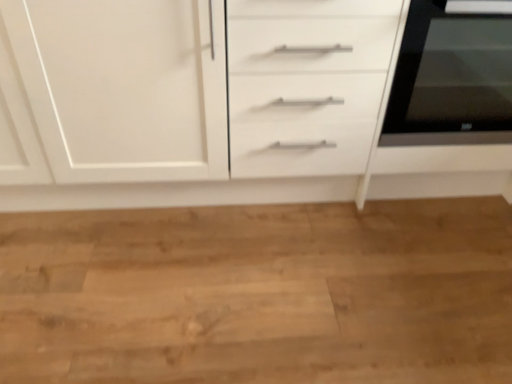
Question: Is white matte cabinet at center at the back of black glass oven at right?

Choices:
 (A) no
 (B) yes

Answer: (B)

Question: Is black glass oven at right shorter than white matte cabinet at center?

Choices:
 (A) yes
 (B) no

Answer: (A)

Question: From a real-world perspective, is black glass oven at right located higher than white matte cabinet at center?

Choices:
 (A) yes
 (B) no

Answer: (A)

Question: Can you confirm if black glass oven at right is thinner than white matte cabinet at center?

Choices:
 (A) no
 (B) yes

Answer: (B)

Question: Considering the relative sizes of black glass oven at right and white matte cabinet at center in the image provided, is black glass oven at right bigger than white matte cabinet at center?

Choices:
 (A) no
 (B) yes

Answer: (A)

Question: Is black glass oven at right to the left of white matte cabinet at center from the viewer's perspective?

Choices:
 (A) yes
 (B) no

Answer: (B)

Question: Can black glass oven at right be found inside white matte cabinet at center?

Choices:
 (A) no
 (B) yes

Answer: (B)

Question: Considering the relative positions of white matte cabinet at center and black glass oven at right in the image provided, is white matte cabinet at center to the left of black glass oven at right from the viewer's perspective?

Choices:
 (A) no
 (B) yes

Answer: (B)

Question: Can we say white matte cabinet at center lies outside black glass oven at right?

Choices:
 (A) yes
 (B) no

Answer: (A)

Question: From the image's perspective, is white matte cabinet at center under black glass oven at right?

Choices:
 (A) no
 (B) yes

Answer: (B)

Question: Can you confirm if white matte cabinet at center is taller than black glass oven at right?

Choices:
 (A) yes
 (B) no

Answer: (A)

Question: From a real-world perspective, does white matte cabinet at center stand above black glass oven at right?

Choices:
 (A) no
 (B) yes

Answer: (A)

Question: Is black glass oven at right wider or thinner than white matte cabinet at center?

Choices:
 (A) wide
 (B) thin

Answer: (B)